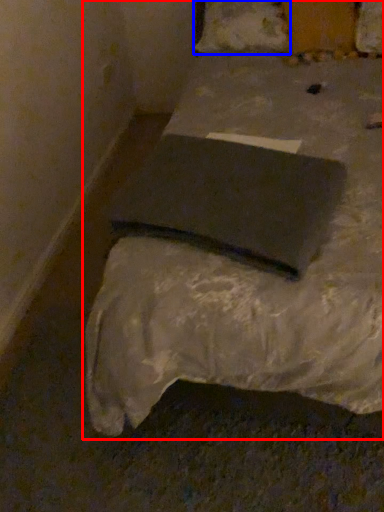
Question: Which point is further to the camera, bed (highlighted by a red box) or pillow (highlighted by a blue box)?

Choices:
 (A) bed
 (B) pillow

Answer: (B)